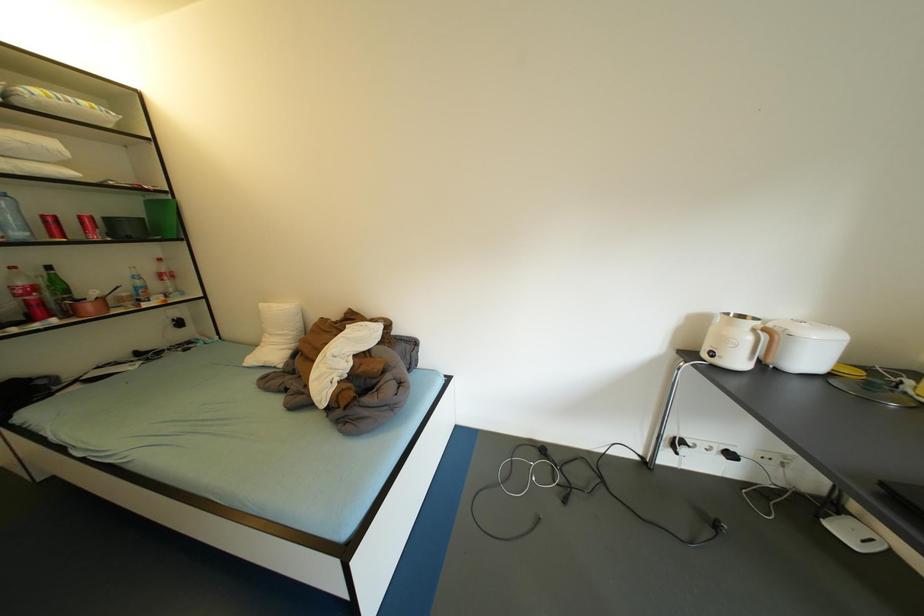
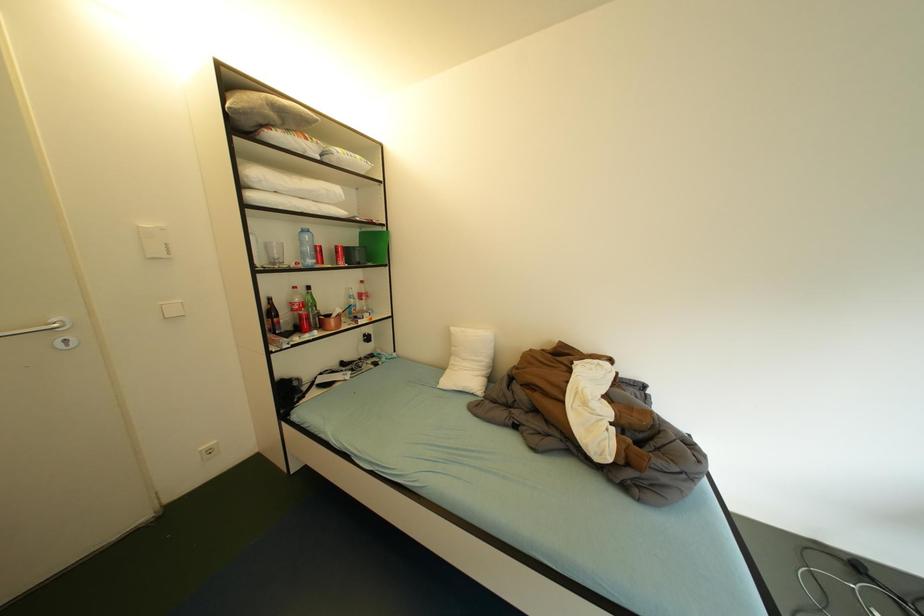
Question: The camera is either moving clockwise (left) or counter-clockwise (right) around the object. The first image is from the beginning of the video and the second image is from the end. Is the camera moving left or right when shooting the video?

Choices:
 (A) Left
 (B) Right

Answer: (B)